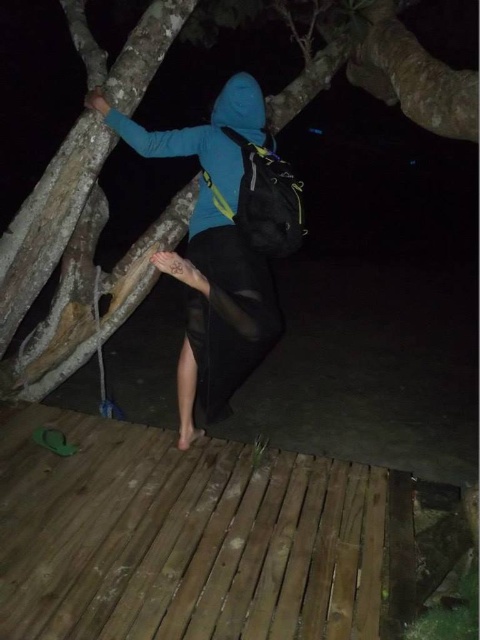
You are a photographer trying to capture the climber in the nighttime scene. You notice the rough bark tree at upper center and the blue fleece hoodie at upper center. Which object should you focus on first if you want to ensure both are in sharp focus?

You should focus on the rough bark tree at upper center first because it is closer to you than the blue fleece hoodie at upper center. By focusing on the closer object, the background object may still be in acceptable focus depending on the lens and aperture used.

You are a park ranger assessing a tree climbing site. The coordinates given correspond to a specific location on the tree. Based on the scene description, what does the point at coordinates (389, 77) indicate about the tree?

The point at coordinates (389, 77) marks the rough bark tree at upper center, indicating that the tree has a textured surface in that area.

You are a park ranger assessing safety conditions in the forest. You notice the rough bark tree at upper center and the blue matte jacket at upper center in the image. Which object is wider according to the description?

The rough bark tree at upper center is wider than the blue matte jacket at upper center.